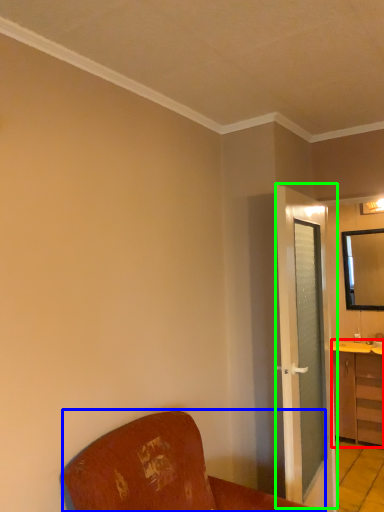
Question: Which is farther away from cabinetry (highlighted by a red box)? furniture (highlighted by a blue box) or door (highlighted by a green box)?

Choices:
 (A) furniture
 (B) door

Answer: (A)